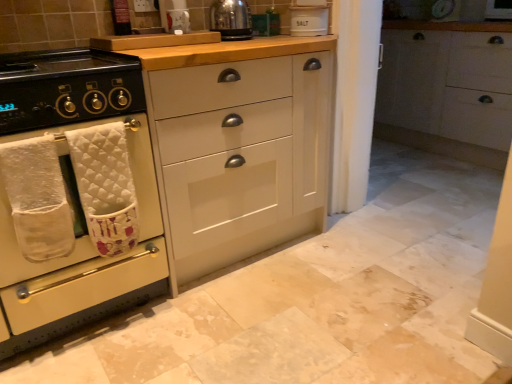
What are the coordinates of `white quilted bath towel at left, positioned as the 2th bath towel in left-to-right order` in the screenshot? It's located at (105, 186).

What is the approximate width of black matte gas stove at left?

black matte gas stove at left is 25.03 inches in width.

Describe the element at coordinates (439, 93) in the screenshot. I see `white matte cabinet at right, which is counted as the 1th cabinetry, starting from the right` at that location.

Image resolution: width=512 pixels, height=384 pixels. Find the location of `matte white cabinet at center, the second cabinetry in the right-to-left sequence`. matte white cabinet at center, the second cabinetry in the right-to-left sequence is located at coordinates tap(241, 156).

What's the angular difference between shiny metallic kettle at upper center and white matte cabinet at center, which is the 3th cabinetry in right-to-left order,'s facing directions?

They differ by 0.812 degrees in their facing directions.

From a real-world perspective, is shiny metallic kettle at upper center beneath white matte cabinet at center, which is the 3th cabinetry in right-to-left order?

Actually, shiny metallic kettle at upper center is physically above white matte cabinet at center, which is the 3th cabinetry in right-to-left order, in the real world.

From the image's perspective, which one is positioned lower, shiny metallic kettle at upper center or white matte cabinet at center, acting as the first cabinetry starting from the left?

From the image's view, white matte cabinet at center, acting as the first cabinetry starting from the left, is below.

Would you consider shiny metallic kettle at upper center to be distant from white matte cabinet at center, acting as the first cabinetry starting from the left?

No, shiny metallic kettle at upper center is in close proximity to white matte cabinet at center, acting as the first cabinetry starting from the left.

In terms of size, does matte white cabinet at center, the second cabinetry in the right-to-left sequence, appear bigger or smaller than black matte gas stove at left?

matte white cabinet at center, the second cabinetry in the right-to-left sequence, is bigger than black matte gas stove at left.

Between matte white cabinet at center, the second cabinetry in the right-to-left sequence, and black matte gas stove at left, which one has less height?

black matte gas stove at left.

Identify the location of the 1st cabinetry to the right of the black matte gas stove at left, counting from the anchor's position. (241, 156).

From the image's perspective, is matte white cabinet at center, the 2th cabinetry from the left, above black matte gas stove at left?

No, from the image's perspective, matte white cabinet at center, the 2th cabinetry from the left, is not on top of black matte gas stove at left.

Does black matte gas stove at left appear on the right side of matte white cabinet at center, the 2th cabinetry from the left?

No.

Are black matte gas stove at left and matte white cabinet at center, the 2th cabinetry from the left, beside each other?

black matte gas stove at left and matte white cabinet at center, the 2th cabinetry from the left, are not in contact.

From a real-world perspective, which is physically below, black matte gas stove at left or matte white cabinet at center, the second cabinetry in the right-to-left sequence?

From a 3D spatial view, matte white cabinet at center, the second cabinetry in the right-to-left sequence, is below.

In the scene shown: From the image's perspective, which is above, shiny metallic kettle at upper center or white quilted bath towel at left, the 2th bath towel in the right-to-left sequence?

shiny metallic kettle at upper center is shown above in the image.

Could you tell me if shiny metallic kettle at upper center is turned towards white quilted bath towel at left, the 2th bath towel in the right-to-left sequence?

No, shiny metallic kettle at upper center is not facing towards white quilted bath towel at left, the 2th bath towel in the right-to-left sequence.

How distant is shiny metallic kettle at upper center from white quilted bath towel at left, the 2th bath towel in the right-to-left sequence?

shiny metallic kettle at upper center and white quilted bath towel at left, the 2th bath towel in the right-to-left sequence, are 3.34 feet apart.

Which object is wider, shiny metallic kettle at upper center or white quilted bath towel at left, arranged as the 1th bath towel when viewed from the left?

shiny metallic kettle at upper center.

From the image's perspective, which object appears higher, white matte cabinet at center, which is the 3th cabinetry in right-to-left order, or white matte cabinet at right, which is counted as the 1th cabinetry, starting from the right?

white matte cabinet at right, which is counted as the 1th cabinetry, starting from the right, from the image's perspective.

Is white matte cabinet at center, acting as the first cabinetry starting from the left, oriented away from white matte cabinet at right, which is counted as the 1th cabinetry, starting from the right?

white matte cabinet at center, acting as the first cabinetry starting from the left, does not have its back to white matte cabinet at right, which is counted as the 1th cabinetry, starting from the right.

Is white matte cabinet at center, acting as the first cabinetry starting from the left, not close to white matte cabinet at right, which is counted as the 1th cabinetry, starting from the right?

Absolutely, white matte cabinet at center, acting as the first cabinetry starting from the left, is distant from white matte cabinet at right, which is counted as the 1th cabinetry, starting from the right.

Starting from the white matte cabinet at right, which is counted as the 1th cabinetry, starting from the right, which cabinetry is the 2nd one to the left? Please provide its 2D coordinates.

[(78, 192)]

How different are the orientations of matte white cabinet at center, the 2th cabinetry from the left, and white matte cabinet at right, which is counted as the 1th cabinetry, starting from the right, in degrees?

The angular difference between matte white cabinet at center, the 2th cabinetry from the left, and white matte cabinet at right, which is counted as the 1th cabinetry, starting from the right, is 90.8 degrees.

Is matte white cabinet at center, the 2th cabinetry from the left, aimed at white matte cabinet at right, which is counted as the 1th cabinetry, starting from the right?

No, matte white cabinet at center, the 2th cabinetry from the left, does not turn towards white matte cabinet at right, which is counted as the 1th cabinetry, starting from the right.

Relative to white matte cabinet at right, which is counted as the 1th cabinetry, starting from the right, is matte white cabinet at center, the 2th cabinetry from the left, in front or behind?

Clearly, matte white cabinet at center, the 2th cabinetry from the left, is in front of white matte cabinet at right, which is counted as the 1th cabinetry, starting from the right.

Is matte white cabinet at center, the second cabinetry in the right-to-left sequence, positioned far away from white matte cabinet at right, which is counted as the 1th cabinetry, starting from the right?

Absolutely, matte white cabinet at center, the second cabinetry in the right-to-left sequence, is distant from white matte cabinet at right, which is counted as the 1th cabinetry, starting from the right.

How different are the orientations of white matte cabinet at right, which is counted as the third cabinetry, starting from the left, and white ceramic salt container at upper center in degrees?

The angular difference between white matte cabinet at right, which is counted as the third cabinetry, starting from the left, and white ceramic salt container at upper center is 23.3 degrees.

From a real-world perspective, who is located higher, white matte cabinet at right, which is counted as the 1th cabinetry, starting from the right, or white ceramic salt container at upper center?

white ceramic salt container at upper center is physically above.

In order to click on the 1st cabinetry located beneath the white ceramic salt container at upper center (from a real-world perspective) in this screenshot , I will do `click(439, 93)`.

Is point (501, 59) positioned before point (323, 29)?

No, it is not.

Locate an element on the screen. kitchen appliance lying on the right of white matte cabinet at center, acting as the first cabinetry starting from the left is located at coordinates (231, 19).

Where is `gas stove on the left side of matte white cabinet at center, the 2th cabinetry from the left`? gas stove on the left side of matte white cabinet at center, the 2th cabinetry from the left is located at coordinates (67, 88).

Which object lies nearer to the anchor point white matte cabinet at right, which is counted as the third cabinetry, starting from the left, shiny metallic kettle at upper center or white quilted bath towel at left, the 2th bath towel in the right-to-left sequence?

Based on the image, shiny metallic kettle at upper center appears to be nearer to white matte cabinet at right, which is counted as the third cabinetry, starting from the left.

From the image, which object appears to be nearer to black matte gas stove at left, white quilted bath towel at left, arranged as the 1th bath towel when viewed from the left, or white matte cabinet at right, which is counted as the 1th cabinetry, starting from the right?

white quilted bath towel at left, arranged as the 1th bath towel when viewed from the left.

Which object lies further to the anchor point white quilted bath towel at left, positioned as the 2th bath towel in left-to-right order, shiny metallic kettle at upper center or white quilted bath towel at left, the 2th bath towel in the right-to-left sequence?

Among the two, shiny metallic kettle at upper center is located further to white quilted bath towel at left, positioned as the 2th bath towel in left-to-right order.

Based on their spatial positions, is white quilted bath towel at left, the 1th bath towel from the right, or black matte gas stove at left further from white quilted bath towel at left, arranged as the 1th bath towel when viewed from the left?

Among the two, black matte gas stove at left is located further to white quilted bath towel at left, arranged as the 1th bath towel when viewed from the left.

When comparing their distances from white matte cabinet at center, acting as the first cabinetry starting from the left, does shiny metallic kettle at upper center or white matte cabinet at right, which is counted as the third cabinetry, starting from the left, seem further?

white matte cabinet at right, which is counted as the third cabinetry, starting from the left.

Considering their positions, is shiny metallic kettle at upper center positioned closer to white ceramic salt container at upper center than white matte cabinet at center, acting as the first cabinetry starting from the left?

shiny metallic kettle at upper center is positioned closer to the anchor white ceramic salt container at upper center.

When comparing their distances from white quilted bath towel at left, the 1th bath towel from the right, does white quilted bath towel at left, the 2th bath towel in the right-to-left sequence, or white matte cabinet at center, acting as the first cabinetry starting from the left, seem further?

Based on the image, white quilted bath towel at left, the 2th bath towel in the right-to-left sequence, appears to be further to white quilted bath towel at left, the 1th bath towel from the right.

Based on their spatial positions, is black matte gas stove at left or white quilted bath towel at left, the 1th bath towel from the right, closer to shiny metallic kettle at upper center?

black matte gas stove at left is positioned closer to the anchor shiny metallic kettle at upper center.

Locate an element on the screen. kitchen appliance between white ceramic salt container at upper center and white quilted bath towel at left, arranged as the 1th bath towel when viewed from the left, vertically is located at coordinates [x=231, y=19].

I want to click on gas stove that lies between shiny metallic kettle at upper center and white quilted bath towel at left, positioned as the 2th bath towel in left-to-right order, from top to bottom, so click(67, 88).

This screenshot has width=512, height=384. In order to click on kitchen appliance located between black matte gas stove at left and white matte cabinet at right, which is counted as the 1th cabinetry, starting from the right, in the left-right direction in this screenshot , I will do `click(231, 19)`.

Find the location of a particular element. This screenshot has height=384, width=512. appliance located between white quilted bath towel at left, positioned as the 2th bath towel in left-to-right order, and white matte cabinet at right, which is counted as the third cabinetry, starting from the left, in the left-right direction is located at coordinates (309, 18).